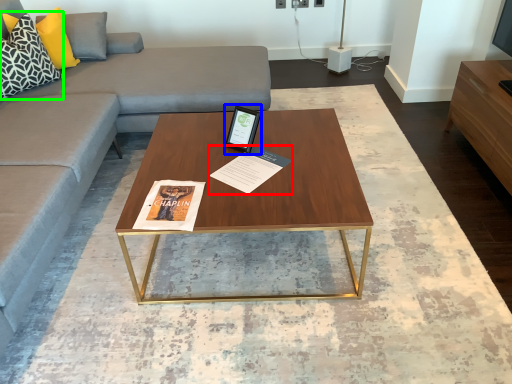
Question: Estimate the real-world distances between objects in this image. Which object is closer to magazine (highlighted by a red box), tablet computer (highlighted by a blue box) or pillow (highlighted by a green box)?

Choices:
 (A) tablet computer
 (B) pillow

Answer: (A)